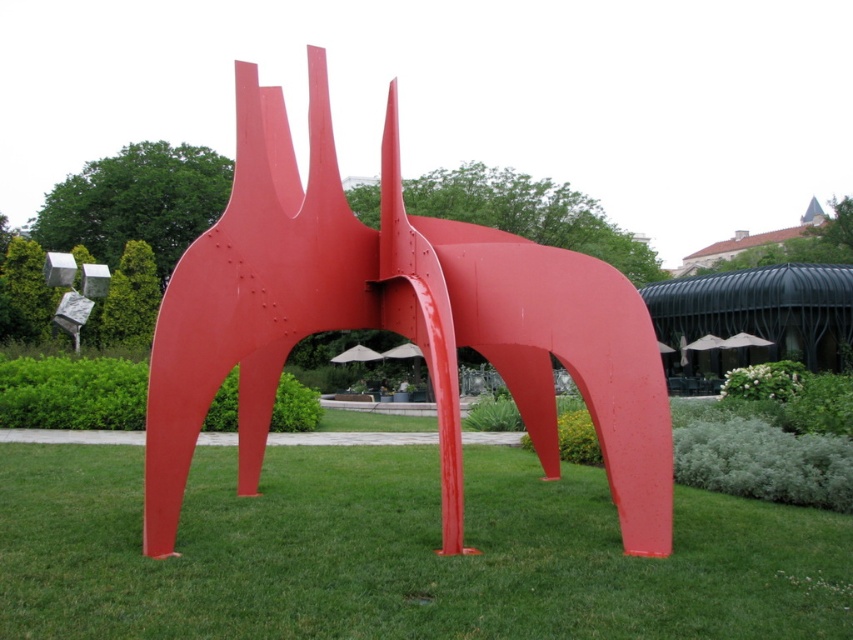
Question: Among these points, which one is nearest to the camera?

Choices:
 (A) (270, 120)
 (B) (263, 556)

Answer: (B)

Question: Is green grass at center to the right of glossy metal sculpture at center from the viewer's perspective?

Choices:
 (A) no
 (B) yes

Answer: (B)

Question: Does green grass at center come behind glossy metal sculpture at center?

Choices:
 (A) no
 (B) yes

Answer: (A)

Question: Does green grass at center appear on the right side of glossy metal sculpture at center?

Choices:
 (A) no
 (B) yes

Answer: (B)

Question: Which point appears closest to the camera in this image?

Choices:
 (A) (195, 243)
 (B) (36, 602)

Answer: (B)